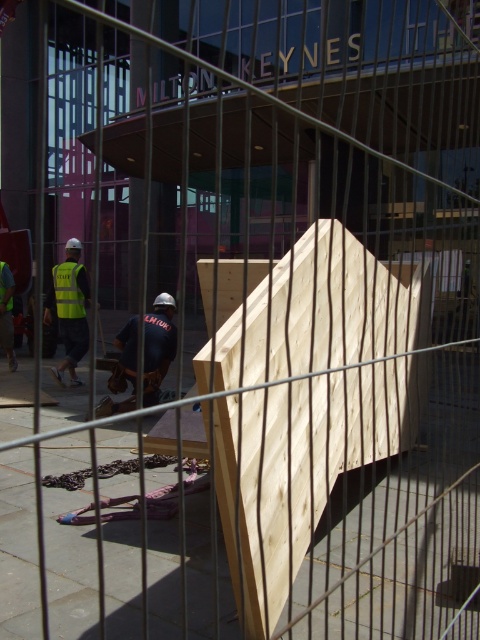
Question: Based on their relative distances, which object is nearer to the high visibility fabric safety vest at lower left?

Choices:
 (A) dark blue shirt at center
 (B) yellow reflective vest at left
 (C) natural wood plywood at center

Answer: (B)

Question: Which point appears farthest from the camera in this image?

Choices:
 (A) (61, 264)
 (B) (296, 358)

Answer: (A)

Question: Observing the image, what is the correct spatial positioning of dark blue shirt at center in reference to yellow reflective vest at left?

Choices:
 (A) below
 (B) above

Answer: (A)

Question: Can you confirm if natural wood plywood at center is positioned below yellow reflective vest at left?

Choices:
 (A) no
 (B) yes

Answer: (B)

Question: Which point is farther from the camera taking this photo?

Choices:
 (A) (133, 387)
 (B) (82, 356)
 (C) (330, 380)
 (D) (6, 296)

Answer: (D)

Question: Does natural wood plywood at center appear on the right side of reflective yellow vest at left?

Choices:
 (A) no
 (B) yes

Answer: (B)